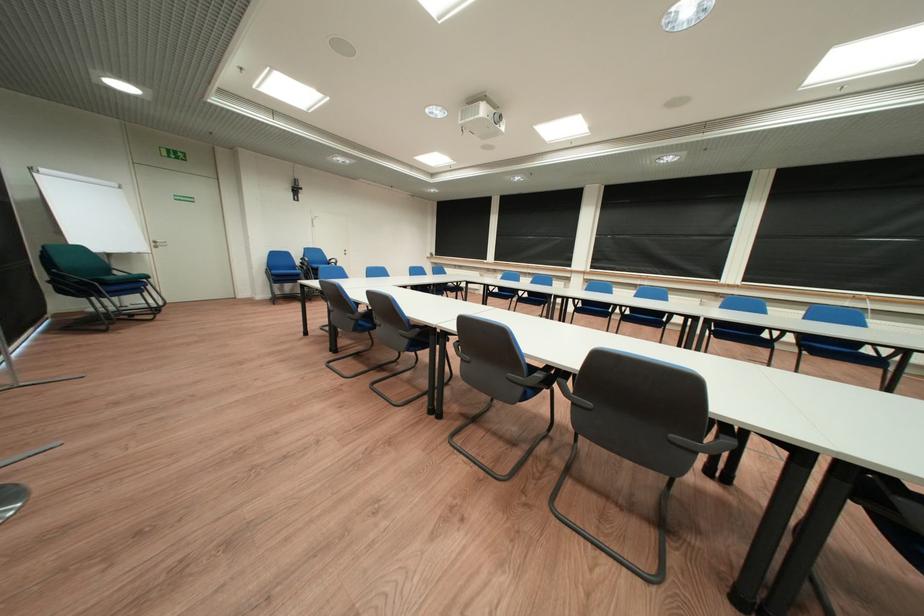
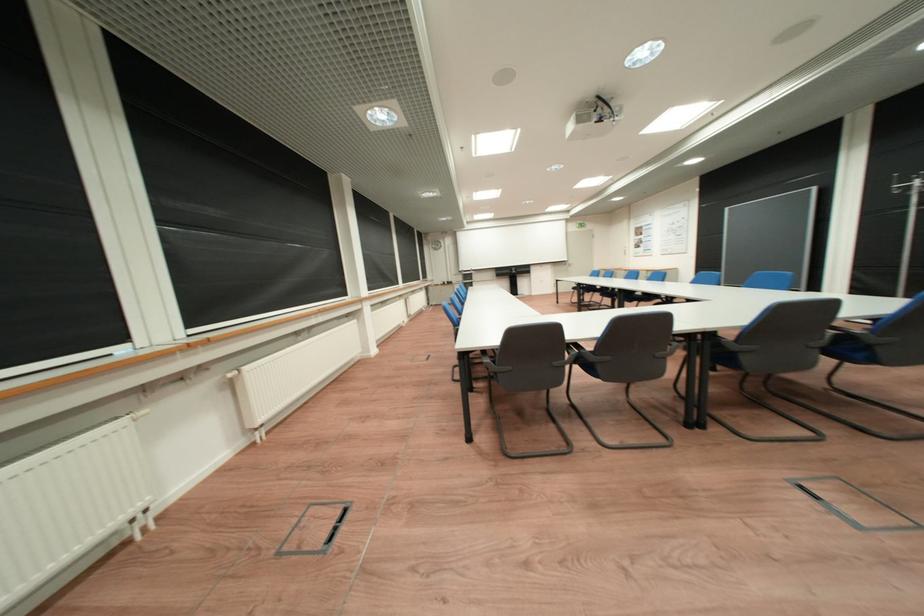
Question: I am providing you with two images of the same scene from different viewpoints. After the viewpoint changes to image2, which objects are now occluded?

Choices:
 (A) blue chair armrest
 (B) black wireless charger
 (C) blue chair sitting surface
 (D) white radiator valve

Answer: (C)